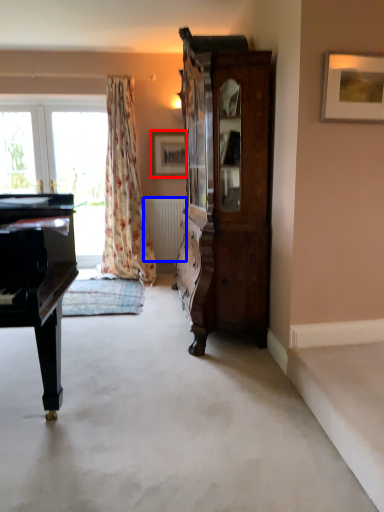
Question: Among these objects, which one is nearest to the camera, picture frame (highlighted by a red box) or radiator (highlighted by a blue box)?

Choices:
 (A) picture frame
 (B) radiator

Answer: (A)